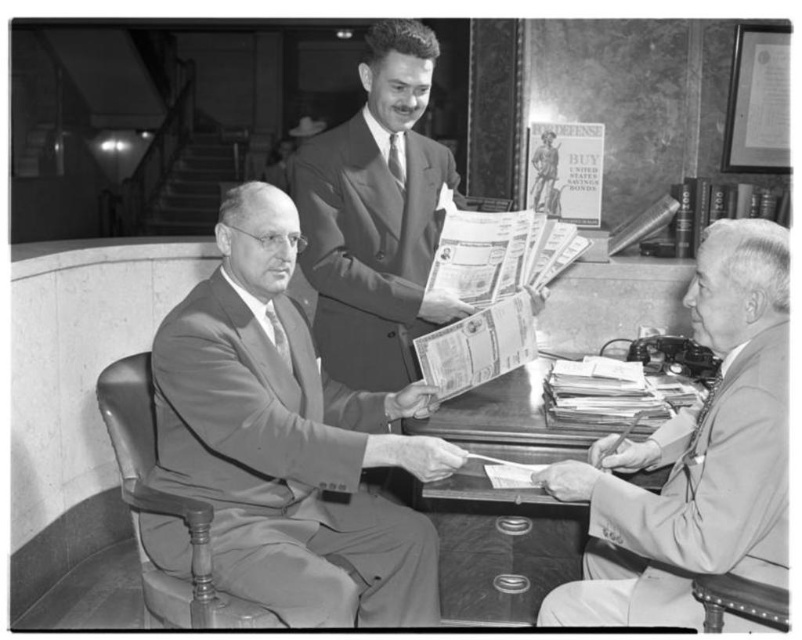
Question: Is smooth gray suit at center closer to camera compared to smooth beige suit at right?

Choices:
 (A) no
 (B) yes

Answer: (A)

Question: Which of these objects is positioned closest to the smooth gray suit at center?

Choices:
 (A) smooth suit at center
 (B) smooth beige suit at right

Answer: (A)

Question: Considering the relative positions of smooth suit at center and wooden desk at center in the image provided, where is smooth suit at center located with respect to wooden desk at center?

Choices:
 (A) left
 (B) right

Answer: (A)

Question: Can you confirm if smooth gray suit at center is positioned to the right of smooth suit at center?

Choices:
 (A) yes
 (B) no

Answer: (B)

Question: Which point is farther from the camera taking this photo?

Choices:
 (A) (495, 444)
 (B) (630, 595)

Answer: (A)

Question: Which point appears closest to the camera in this image?

Choices:
 (A) (565, 563)
 (B) (371, 122)
 (C) (764, 497)
 (D) (323, 385)

Answer: (C)